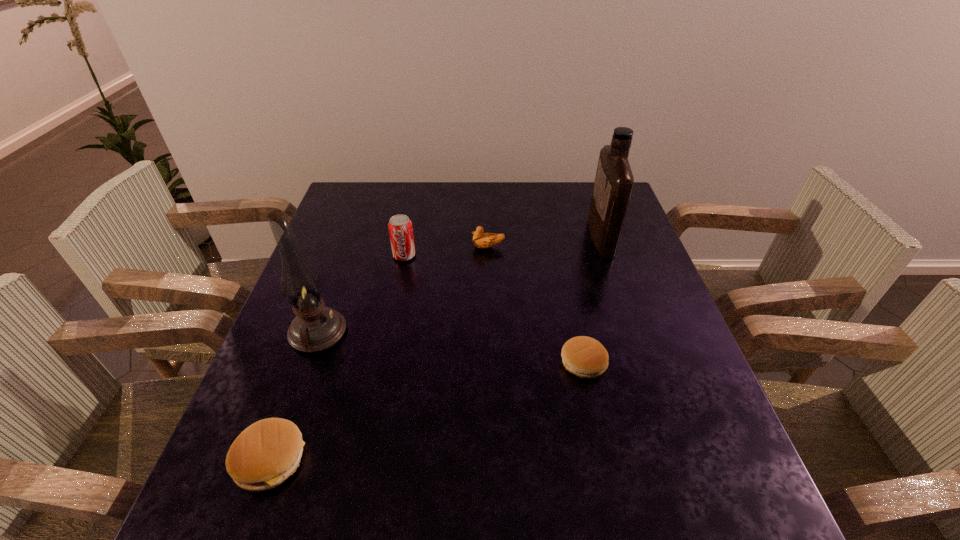
Image resolution: width=960 pixels, height=540 pixels. I want to click on object that is at the near edge, so click(x=265, y=454).

Find the location of `patty located at the left edge`. patty located at the left edge is located at coordinates (265, 454).

Find the location of `oil lamp situated at the left edge`. oil lamp situated at the left edge is located at coordinates (315, 328).

In order to click on object present at the right edge in this screenshot , I will do `click(614, 181)`.

Identify the location of object that is at the near left corner. coord(265,454).

Identify the location of object positioned at the far right corner. (614, 181).

In the image, there is a desktop. At what (x,y) coordinates should I click in order to perform the action: click on vacant space at the far edge. Please return your answer as a coordinate pair (x, y). Looking at the image, I should click on (482, 190).

Image resolution: width=960 pixels, height=540 pixels. I want to click on free spot at the near edge of the desktop, so click(471, 431).

Locate an element on the screen. free space at the left edge is located at coordinates (290, 363).

The image size is (960, 540). I want to click on vacant area at the right edge, so click(590, 250).